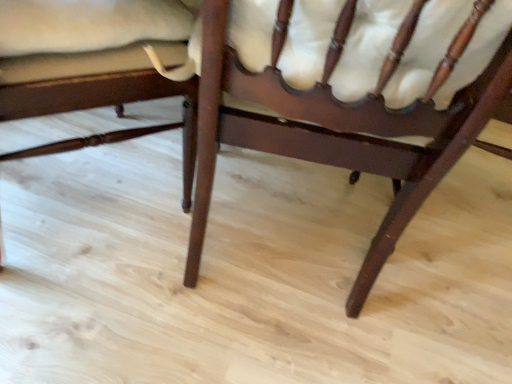
Question: Is the position of mahogany wood chair at center, arranged as the 1th chair when viewed from the right, more distant than that of matte dark wood chair at lower left, arranged as the 1th chair when viewed from the left?

Choices:
 (A) yes
 (B) no

Answer: (B)

Question: Does mahogany wood chair at center, the second chair in the left-to-right sequence, have a greater width compared to matte dark wood chair at lower left, the second chair viewed from the right?

Choices:
 (A) no
 (B) yes

Answer: (A)

Question: From the image's perspective, is mahogany wood chair at center, the second chair in the left-to-right sequence, on matte dark wood chair at lower left, the second chair viewed from the right?

Choices:
 (A) no
 (B) yes

Answer: (A)

Question: From a real-world perspective, is mahogany wood chair at center, the second chair in the left-to-right sequence, physically above matte dark wood chair at lower left, the second chair viewed from the right?

Choices:
 (A) yes
 (B) no

Answer: (A)

Question: Is matte dark wood chair at lower left, arranged as the 1th chair when viewed from the left, located within mahogany wood chair at center, the second chair in the left-to-right sequence?

Choices:
 (A) no
 (B) yes

Answer: (A)

Question: Is mahogany wood chair at center, the second chair in the left-to-right sequence, not close to matte dark wood chair at lower left, the second chair viewed from the right?

Choices:
 (A) yes
 (B) no

Answer: (B)

Question: From a real-world perspective, does matte dark wood chair at lower left, arranged as the 1th chair when viewed from the left, sit lower than mahogany wood chair at center, the second chair in the left-to-right sequence?

Choices:
 (A) no
 (B) yes

Answer: (B)

Question: From the image's perspective, is matte dark wood chair at lower left, the second chair viewed from the right, beneath mahogany wood chair at center, arranged as the 1th chair when viewed from the right?

Choices:
 (A) yes
 (B) no

Answer: (B)

Question: Is matte dark wood chair at lower left, arranged as the 1th chair when viewed from the left, aimed at mahogany wood chair at center, arranged as the 1th chair when viewed from the right?

Choices:
 (A) no
 (B) yes

Answer: (A)

Question: Considering the relative positions of matte dark wood chair at lower left, arranged as the 1th chair when viewed from the left, and mahogany wood chair at center, arranged as the 1th chair when viewed from the right, in the image provided, is matte dark wood chair at lower left, arranged as the 1th chair when viewed from the left, to the left of mahogany wood chair at center, arranged as the 1th chair when viewed from the right, from the viewer's perspective?

Choices:
 (A) no
 (B) yes

Answer: (B)

Question: Does matte dark wood chair at lower left, the second chair viewed from the right, have a larger size compared to mahogany wood chair at center, arranged as the 1th chair when viewed from the right?

Choices:
 (A) yes
 (B) no

Answer: (A)

Question: Is matte dark wood chair at lower left, the second chair viewed from the right, surrounding mahogany wood chair at center, arranged as the 1th chair when viewed from the right?

Choices:
 (A) yes
 (B) no

Answer: (B)

Question: Do you think mahogany wood chair at center, the second chair in the left-to-right sequence, is within matte dark wood chair at lower left, the second chair viewed from the right, or outside of it?

Choices:
 (A) outside
 (B) inside

Answer: (A)